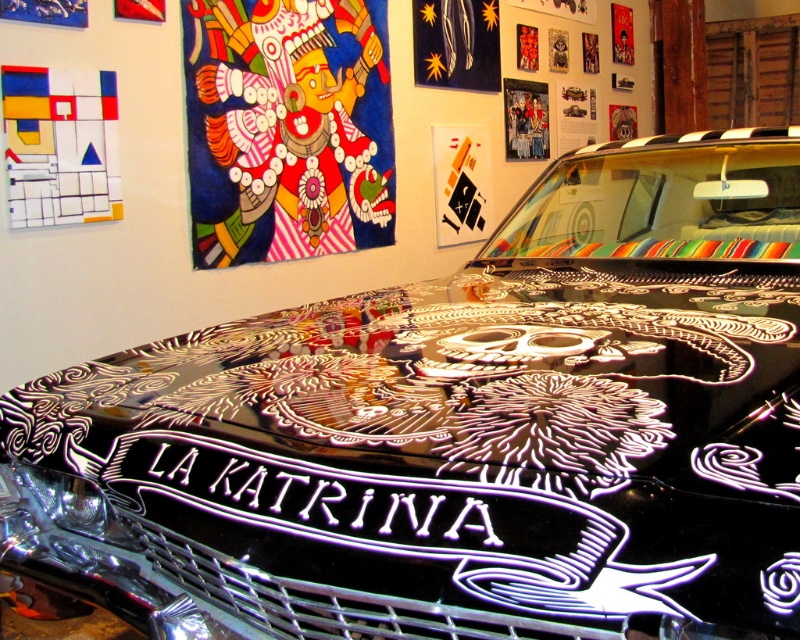
You are standing in front of an art installation and want to take a photo of the vibrant painted mask at upper left without including the car with LA KATRINA artwork in the frame. What is the minimum distance you need to move away from the mask to ensure the car is out of the shot?

To ensure the car with LA KATRINA artwork is not in the photo, you need to move at least 4.28 meters away from the vibrant painted mask at upper left, as that is the distance between the mask and the camera.

You are an art critic analyzing the car and its surrounding artwork. You notice the vibrant painted mask at upper left and the matte white geometric shapes at upper left. Which object is closer to the viewer in the upper left area?

The vibrant painted mask at upper left is closer to the viewer than the matte white geometric shapes at upper left, which are positioned behind it.

You are an art curator planning to display the vibrant painted mask at upper left and the matte white geometric shapes at upper left in a new exhibition. Which object should you choose if you want to feature a piece with a larger size?

The vibrant painted mask at upper left should be chosen because its width is larger than the matte white geometric shapes at upper left.